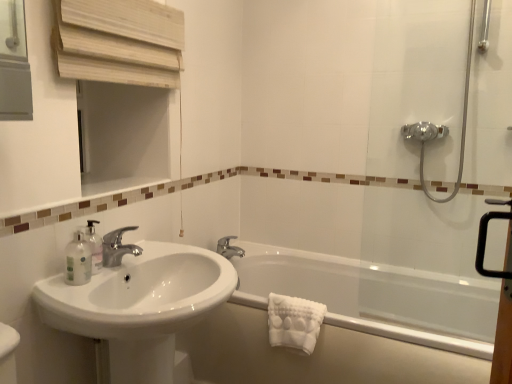
Image resolution: width=512 pixels, height=384 pixels. What are the coordinates of `free space to the back side of polished chrome faucet at center, acting as the 2th tap starting from the back` in the screenshot? It's located at (153, 248).